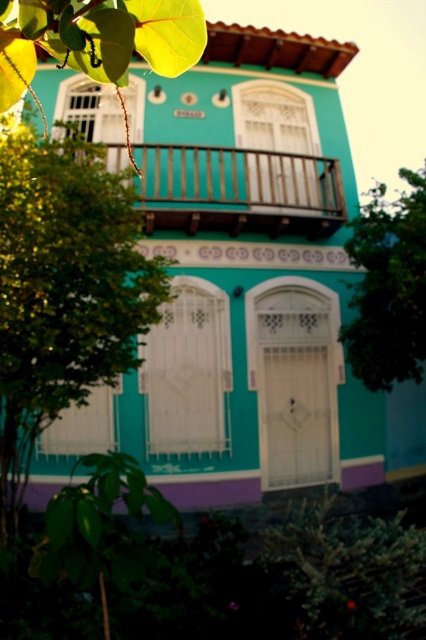
Question: Which point is closer to the camera?

Choices:
 (A) green leafy tree at lower left
 (B) wooden at upper center
 (C) green leafy tree at left

Answer: (A)

Question: Is green leafy tree at upper right below green leafy tree at lower left?

Choices:
 (A) no
 (B) yes

Answer: (A)

Question: Is wooden at upper center below green leafy tree at lower left?

Choices:
 (A) yes
 (B) no

Answer: (B)

Question: Which of these objects is positioned closest to the green leafy tree at upper right?

Choices:
 (A) green leafy tree at lower left
 (B) green leafy tree at left

Answer: (B)

Question: Estimate the real-world distances between objects in this image. Which object is closer to the green leafy tree at left?

Choices:
 (A) green leafy tree at lower left
 (B) wooden at upper center

Answer: (A)

Question: Is wooden at upper center positioned behind green leafy tree at lower left?

Choices:
 (A) no
 (B) yes

Answer: (B)